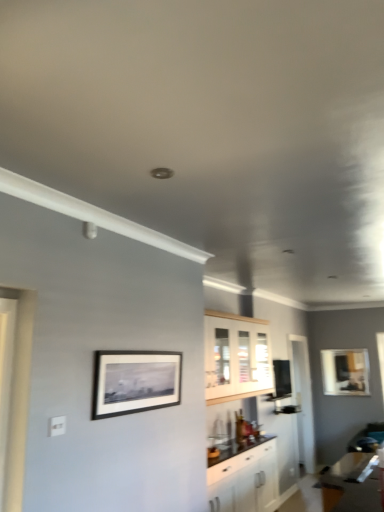
Image resolution: width=384 pixels, height=512 pixels. In order to click on white wood cabinet at center, positioned as the 2th cabinetry in bottom-to-top order in this screenshot , I will do `click(236, 356)`.

Locate an element on the screen. Image resolution: width=384 pixels, height=512 pixels. transparent glass door at center is located at coordinates (303, 399).

The image size is (384, 512). What do you see at coordinates (303, 399) in the screenshot?
I see `transparent glass door at center` at bounding box center [303, 399].

Image resolution: width=384 pixels, height=512 pixels. I want to click on black matte picture frame at upper center, which ranks as the 2th picture frame in right-to-left order, so click(x=135, y=381).

Locate an element on the screen. Image resolution: width=384 pixels, height=512 pixels. white wood cabinet at center, positioned as the 1th cabinetry in top-to-bottom order is located at coordinates (236, 356).

Is black matte picture frame at upper center, the second picture frame from the back, positioned far away from transparent glass door at center?

Yes, black matte picture frame at upper center, the second picture frame from the back, is far from transparent glass door at center.

Is transparent glass door at center located within black matte picture frame at upper center, which is the first picture frame in left-to-right order?

No, transparent glass door at center is not surrounded by black matte picture frame at upper center, which is the first picture frame in left-to-right order.

Considering the sizes of objects black matte picture frame at upper center, the first picture frame positioned from the top, and transparent glass door at center in the image provided, who is taller, black matte picture frame at upper center, the first picture frame positioned from the top, or transparent glass door at center?

transparent glass door at center.

Consider the image. From a real-world perspective, is black matte picture frame at upper center, the second picture frame in the bottom-to-top sequence, positioned above or below transparent glass door at center?

In terms of real-world spatial position, black matte picture frame at upper center, the second picture frame in the bottom-to-top sequence, is above transparent glass door at center.

Which is less distant, (x=218, y=486) or (x=158, y=364)?

Point (x=158, y=364)

Consider the image. Measure the distance between white glossy cabinet at center, the 1th cabinetry from the bottom, and black matte picture frame at upper center, the second picture frame from the back.

They are 1.80 meters apart.

Does white glossy cabinet at center, acting as the second cabinetry starting from the top, have a smaller size compared to black matte picture frame at upper center, which is the first picture frame in left-to-right order?

No, white glossy cabinet at center, acting as the second cabinetry starting from the top, is not smaller than black matte picture frame at upper center, which is the first picture frame in left-to-right order.

From a real-world perspective, is white glossy cabinet at center, acting as the second cabinetry starting from the top, physically located above or below black matte picture frame at upper center, the first picture frame positioned from the top?

In terms of real-world spatial position, white glossy cabinet at center, acting as the second cabinetry starting from the top, is below black matte picture frame at upper center, the first picture frame positioned from the top.

Which of these two, white wood cabinet at center, positioned as the 1th cabinetry in top-to-bottom order, or white glossy cabinet at center, the 1th cabinetry from the bottom, is wider?

Wider between the two is white glossy cabinet at center, the 1th cabinetry from the bottom.

From a real-world perspective, is white wood cabinet at center, positioned as the 1th cabinetry in top-to-bottom order, positioned under white glossy cabinet at center, acting as the second cabinetry starting from the top, based on gravity?

No, from a real-world perspective, white wood cabinet at center, positioned as the 1th cabinetry in top-to-bottom order, is not below white glossy cabinet at center, acting as the second cabinetry starting from the top.

From the image's perspective, is white wood cabinet at center, positioned as the 1th cabinetry in top-to-bottom order, above white glossy cabinet at center, acting as the second cabinetry starting from the top?

Indeed, from the image's perspective, white wood cabinet at center, positioned as the 1th cabinetry in top-to-bottom order, is shown above white glossy cabinet at center, acting as the second cabinetry starting from the top.

Is white wood cabinet at center, positioned as the 2th cabinetry in bottom-to-top order, facing towards white glossy cabinet at center, the 1th cabinetry from the bottom?

No, white wood cabinet at center, positioned as the 2th cabinetry in bottom-to-top order, is not aimed at white glossy cabinet at center, the 1th cabinetry from the bottom.

From the image's perspective, is white wood cabinet at center, positioned as the 2th cabinetry in bottom-to-top order, over transparent glass door at center?

Yes.

From a real-world perspective, is white wood cabinet at center, positioned as the 1th cabinetry in top-to-bottom order, on transparent glass door at center?

Yes, from a real-world perspective, white wood cabinet at center, positioned as the 1th cabinetry in top-to-bottom order, is over transparent glass door at center

From their relative heights in the image, would you say white wood cabinet at center, positioned as the 1th cabinetry in top-to-bottom order, is taller or shorter than transparent glass door at center?

white wood cabinet at center, positioned as the 1th cabinetry in top-to-bottom order, is shorter than transparent glass door at center.

Is white wood cabinet at center, positioned as the 1th cabinetry in top-to-bottom order, spatially inside transparent glass door at center, or outside of it?

white wood cabinet at center, positioned as the 1th cabinetry in top-to-bottom order, lies outside transparent glass door at center.

Can you tell me how much white wood cabinet at center, positioned as the 1th cabinetry in top-to-bottom order, and black matte picture frame at upper center, the second picture frame from the back, differ in facing direction?

There is a 0.195-degree angle between the facing directions of white wood cabinet at center, positioned as the 1th cabinetry in top-to-bottom order, and black matte picture frame at upper center, the second picture frame from the back.

Is black matte picture frame at upper center, the first picture frame positioned from the top, located within white wood cabinet at center, positioned as the 1th cabinetry in top-to-bottom order?

No.

Is white wood cabinet at center, positioned as the 2th cabinetry in bottom-to-top order, facing towards black matte picture frame at upper center, the second picture frame from the back?

No, white wood cabinet at center, positioned as the 2th cabinetry in bottom-to-top order, is not oriented towards black matte picture frame at upper center, the second picture frame from the back.

Would you say white wood cabinet at center, positioned as the 2th cabinetry in bottom-to-top order, is to the left or to the right of black matte picture frame at upper center, the second picture frame from the back, in the picture?

Clearly, white wood cabinet at center, positioned as the 2th cabinetry in bottom-to-top order, is on the right of black matte picture frame at upper center, the second picture frame from the back, in the image.

Considering the relative positions of transparent glass door at center and white wood cabinet at center, positioned as the 1th cabinetry in top-to-bottom order, in the image provided, is transparent glass door at center in front of white wood cabinet at center, positioned as the 1th cabinetry in top-to-bottom order,?

No, transparent glass door at center is further to the viewer.

Choose the correct answer: Is transparent glass door at center inside white wood cabinet at center, positioned as the 1th cabinetry in top-to-bottom order, or outside it?

transparent glass door at center is outside white wood cabinet at center, positioned as the 1th cabinetry in top-to-bottom order.

From the image's perspective, which one is positioned higher, transparent glass door at center or white wood cabinet at center, positioned as the 1th cabinetry in top-to-bottom order?

white wood cabinet at center, positioned as the 1th cabinetry in top-to-bottom order, is shown above in the image.

Consider the image. Can you tell me how much transparent glass door at center and matte black picture frame at upper right, acting as the 2th picture frame starting from the left, differ in facing direction?

transparent glass door at center and matte black picture frame at upper right, acting as the 2th picture frame starting from the left, are facing 90 degrees away from each other.

From the image's perspective, is transparent glass door at center positioned above or below matte black picture frame at upper right, which appears as the 1th picture frame when viewed from the right?

transparent glass door at center is below matte black picture frame at upper right, which appears as the 1th picture frame when viewed from the right.

Between transparent glass door at center and matte black picture frame at upper right, acting as the 2th picture frame starting from the left, which one has smaller size?

matte black picture frame at upper right, acting as the 2th picture frame starting from the left.

Looking at this image, which is more to the left, transparent glass door at center or matte black picture frame at upper right, the 2th picture frame viewed from the front?

Positioned to the left is transparent glass door at center.

You are a GUI agent. You are given a task and a screenshot of the screen. Output one action in this format:
    pyautogui.click(x=<x>, y=<y>)
    Task: Click on the picture frame in front of the transparent glass door at center
    
    Given the screenshot: What is the action you would take?
    pyautogui.click(x=135, y=381)

This screenshot has width=384, height=512. In order to click on picture frame on the left side of white glossy cabinet at center, acting as the second cabinetry starting from the top in this screenshot , I will do `click(135, 381)`.

Looking at the image, which one is located further to white glossy cabinet at center, acting as the second cabinetry starting from the top, white wood cabinet at center, positioned as the 1th cabinetry in top-to-bottom order, or transparent glass door at center?

The object further to white glossy cabinet at center, acting as the second cabinetry starting from the top, is transparent glass door at center.

Considering their positions, is white wood cabinet at center, positioned as the 2th cabinetry in bottom-to-top order, positioned closer to transparent glass door at center than matte black picture frame at upper right, acting as the first picture frame starting from the back?

Among the two, matte black picture frame at upper right, acting as the first picture frame starting from the back, is located nearer to transparent glass door at center.

From the image, which object appears to be nearer to matte black picture frame at upper right, acting as the 2th picture frame starting from the left, transparent glass door at center or white glossy cabinet at center, acting as the second cabinetry starting from the top?

transparent glass door at center is positioned closer to the anchor matte black picture frame at upper right, acting as the 2th picture frame starting from the left.

Estimate the real-world distances between objects in this image. Which object is closer to white wood cabinet at center, positioned as the 1th cabinetry in top-to-bottom order, transparent glass door at center or white glossy cabinet at center, acting as the second cabinetry starting from the top?

Among the two, white glossy cabinet at center, acting as the second cabinetry starting from the top, is located nearer to white wood cabinet at center, positioned as the 1th cabinetry in top-to-bottom order.

Which object lies nearer to the anchor point matte black picture frame at upper right, which ranks as the 1th picture frame in bottom-to-top order, black matte picture frame at upper center, which ranks as the 2th picture frame in right-to-left order, or white wood cabinet at center, positioned as the 1th cabinetry in top-to-bottom order?

Among the two, white wood cabinet at center, positioned as the 1th cabinetry in top-to-bottom order, is located nearer to matte black picture frame at upper right, which ranks as the 1th picture frame in bottom-to-top order.

Estimate the real-world distances between objects in this image. Which object is closer to white wood cabinet at center, positioned as the 1th cabinetry in top-to-bottom order, black matte picture frame at upper center, arranged as the 1th picture frame when viewed from the front, or white glossy cabinet at center, the 1th cabinetry from the bottom?

Based on the image, white glossy cabinet at center, the 1th cabinetry from the bottom, appears to be nearer to white wood cabinet at center, positioned as the 1th cabinetry in top-to-bottom order.

From the image, which object appears to be farther from white glossy cabinet at center, acting as the second cabinetry starting from the top, black matte picture frame at upper center, the first picture frame positioned from the top, or transparent glass door at center?

Among the two, black matte picture frame at upper center, the first picture frame positioned from the top, is located further to white glossy cabinet at center, acting as the second cabinetry starting from the top.

Looking at the image, which one is located further to white glossy cabinet at center, the 1th cabinetry from the bottom, matte black picture frame at upper right, the 2th picture frame viewed from the front, or white wood cabinet at center, positioned as the 2th cabinetry in bottom-to-top order?

The object further to white glossy cabinet at center, the 1th cabinetry from the bottom, is matte black picture frame at upper right, the 2th picture frame viewed from the front.

Where is `glass door located between white wood cabinet at center, positioned as the 1th cabinetry in top-to-bottom order, and matte black picture frame at upper right, acting as the first picture frame starting from the back, in the depth direction`? This screenshot has height=512, width=384. glass door located between white wood cabinet at center, positioned as the 1th cabinetry in top-to-bottom order, and matte black picture frame at upper right, acting as the first picture frame starting from the back, in the depth direction is located at coordinates (303, 399).

The width and height of the screenshot is (384, 512). I want to click on glass door between black matte picture frame at upper center, which ranks as the 2th picture frame in right-to-left order, and matte black picture frame at upper right, the 2th picture frame viewed from the top, from front to back, so click(x=303, y=399).

Identify the location of cabinetry positioned between white glossy cabinet at center, the 1th cabinetry from the bottom, and matte black picture frame at upper right, which appears as the 1th picture frame when viewed from the right, from near to far. Image resolution: width=384 pixels, height=512 pixels. (236, 356).

Identify the location of cabinetry between white glossy cabinet at center, acting as the second cabinetry starting from the top, and transparent glass door at center, along the z-axis. The height and width of the screenshot is (512, 384). 236,356.